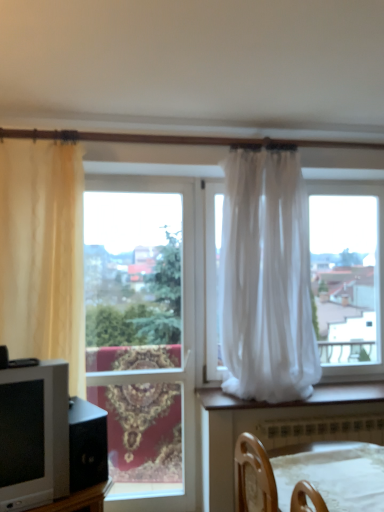
Question: Should I look upward or downward to see beige sheer curtain at left, acting as the 2th curtain starting from the right?

Choices:
 (A) down
 (B) up

Answer: (A)

Question: From a real-world perspective, is beige sheer curtain at left, which is counted as the 1th curtain, starting from the left, on wooden chair at lower center?

Choices:
 (A) no
 (B) yes

Answer: (B)

Question: Considering the relative sizes of beige sheer curtain at left, which is counted as the 1th curtain, starting from the left, and wooden chair at lower center in the image provided, is beige sheer curtain at left, which is counted as the 1th curtain, starting from the left, thinner than wooden chair at lower center?

Choices:
 (A) no
 (B) yes

Answer: (B)

Question: Can you confirm if beige sheer curtain at left, acting as the 2th curtain starting from the right, is shorter than wooden chair at lower center?

Choices:
 (A) yes
 (B) no

Answer: (B)

Question: Does beige sheer curtain at left, acting as the 2th curtain starting from the right, have a greater height compared to wooden chair at lower center?

Choices:
 (A) yes
 (B) no

Answer: (A)

Question: Is beige sheer curtain at left, which is counted as the 1th curtain, starting from the left, next to wooden chair at lower center?

Choices:
 (A) yes
 (B) no

Answer: (B)

Question: Would you say beige sheer curtain at left, which is counted as the 1th curtain, starting from the left, is outside wooden chair at lower center?

Choices:
 (A) yes
 (B) no

Answer: (A)

Question: Is wooden chair at lower center located within white plastic radiator at lower center?

Choices:
 (A) no
 (B) yes

Answer: (A)

Question: Can you confirm if white plastic radiator at lower center is wider than wooden chair at lower center?

Choices:
 (A) yes
 (B) no

Answer: (B)

Question: Is white plastic radiator at lower center to the right of wooden chair at lower center from the viewer's perspective?

Choices:
 (A) yes
 (B) no

Answer: (A)

Question: Considering the relative sizes of white plastic radiator at lower center and wooden chair at lower center in the image provided, is white plastic radiator at lower center bigger than wooden chair at lower center?

Choices:
 (A) yes
 (B) no

Answer: (B)

Question: Is white plastic radiator at lower center positioned behind wooden chair at lower center?

Choices:
 (A) yes
 (B) no

Answer: (A)

Question: From a real-world perspective, is white plastic radiator at lower center positioned under wooden chair at lower center based on gravity?

Choices:
 (A) yes
 (B) no

Answer: (A)

Question: From the image's perspective, is wooden chair at lower center beneath clear glass window at center?

Choices:
 (A) no
 (B) yes

Answer: (B)